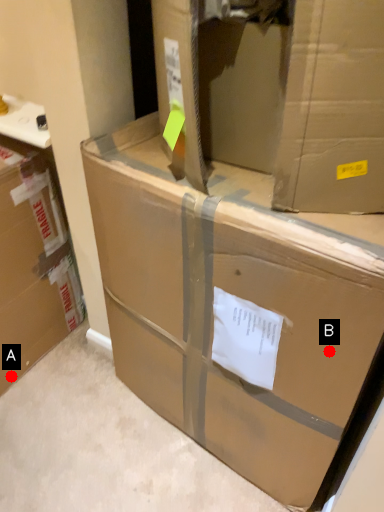
Question: Two points are circled on the image, labeled by A and B beside each circle. Which point is closer to the camera taking this photo?

Choices:
 (A) A is closer
 (B) B is closer

Answer: (B)